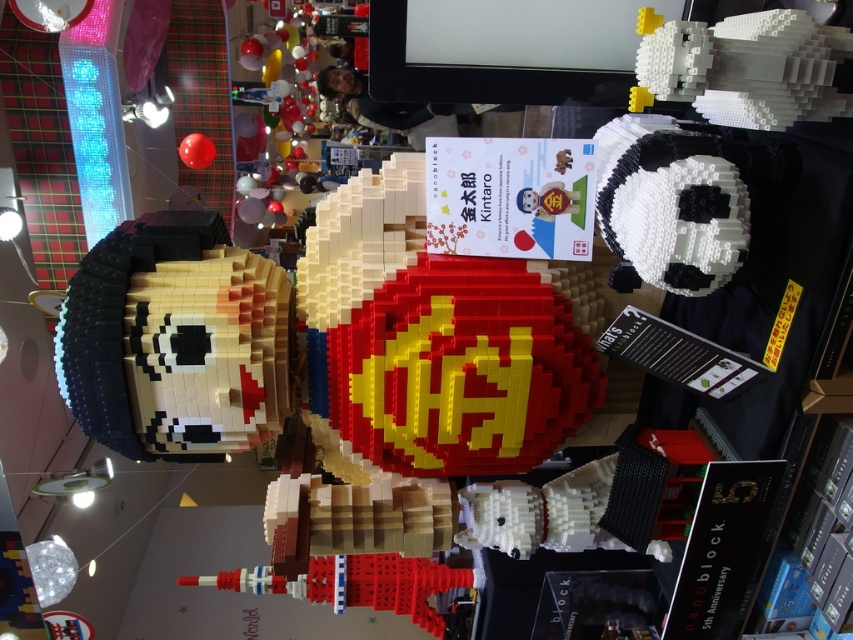
You are standing in front of a display of nanoblock models. There are two points marked in the scene. The first point is at coordinates point (206, 308) and the second is at point (253, 116). Which point is closer to you?

Point (206, 308) is in front of point (253, 116), so it is closer to you.